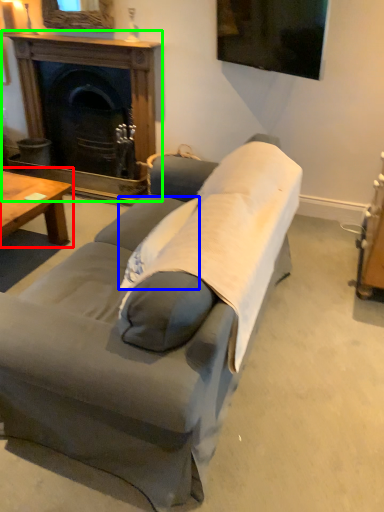
Question: Estimate the real-world distances between objects in this image. Which object is closer to coffee table (highlighted by a red box), pillow (highlighted by a blue box) or fireplace (highlighted by a green box)?

Choices:
 (A) pillow
 (B) fireplace

Answer: (B)